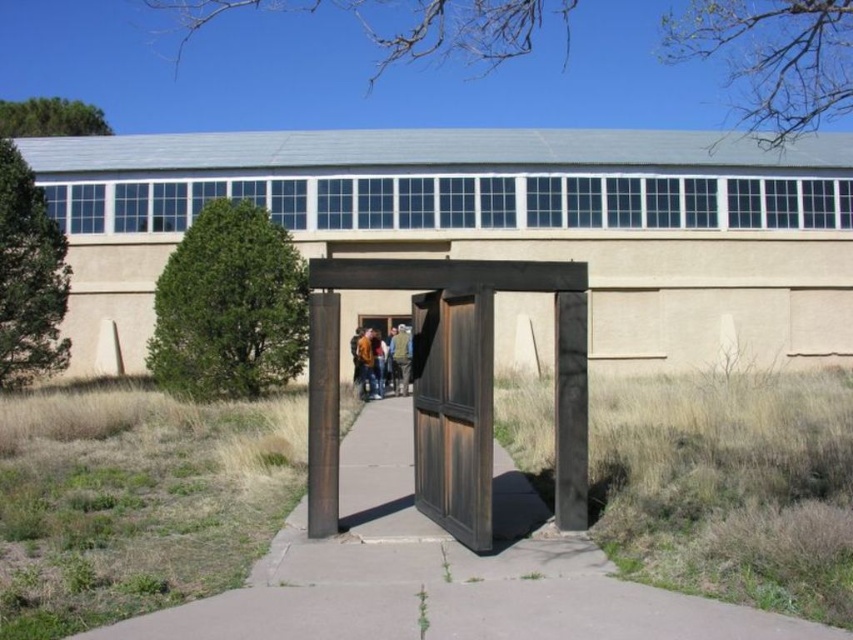
You are a delivery person holding a package and need to place it on the brown concrete pavement at center. However, there is a brown leather jacket at center in the way. Which object should you move to make space for the package?

You should move the brown leather jacket at center because it is taller than the brown concrete pavement at center and can be easily relocated to allow space for the package.